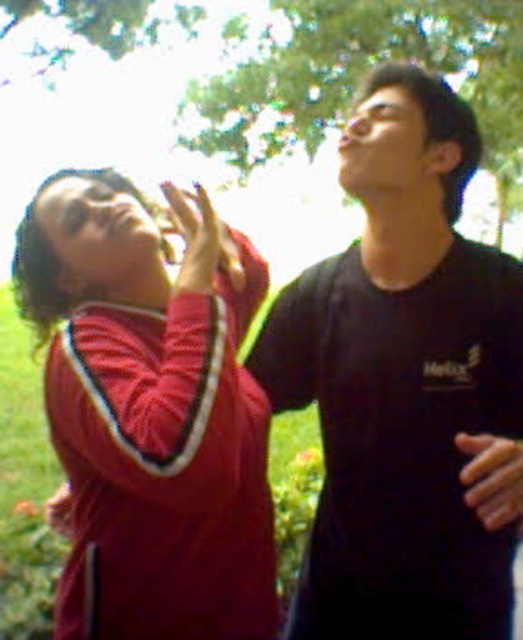
You are a photographer trying to capture a candid shot of the two people in the scene. You notice the black matte shirt at center and the matte red hand at upper left. Which object is positioned higher in the image?

The matte red hand at upper left is positioned higher than the black matte shirt at center.

You are a photographer trying to capture a candid shot of the black matte shirt at center and the matte red hand at upper left. Based on their positions, which object is closer to the camera?

The black matte shirt at center is closer to the camera because it is in front of the matte red hand at upper left.